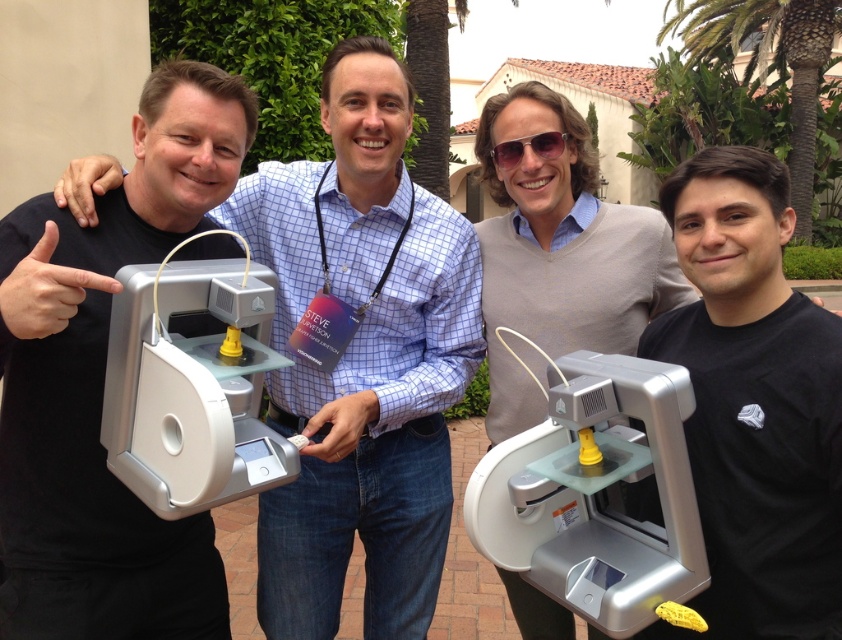
You are standing at the camera position and want to reach the matte silver printer at center. How many steps would you need to take to reach it if each step is about 2.5 feet?

The matte silver printer at center is 6.21 feet away from the camera. Since each step is approximately 2.5 feet, you would need to take about 3 steps to reach it.

You are standing at the point labeled as point (x=809, y=38) and want to walk towards the point labeled as point (x=297, y=316). Based on the scene description, will you be moving towards the group of people or away from them?

You will be moving towards the group of people because point (x=297, y=316) is in front of point (x=809, y=38), indicating that the direction of movement aligns with the group.

Based on the photo, you are standing at the point labeled as point (709, 314) and want to walk towards the point labeled as point (124, 624). Which direction should you face to move directly towards your destination?

You should face downward and to the right because point (124, 624) is located below and to the right of point (709, 314).